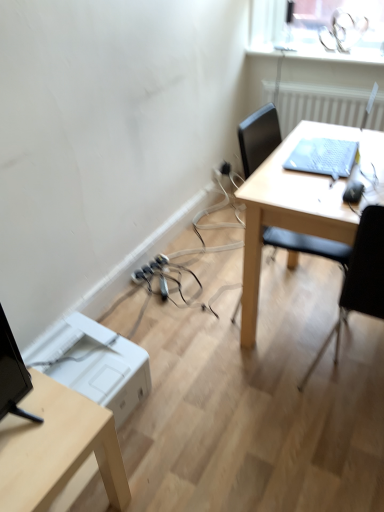
This screenshot has width=384, height=512. What are the coordinates of `vacant point above light wood desk at lower left (from a real-world perspective)` in the screenshot? It's located at (38, 426).